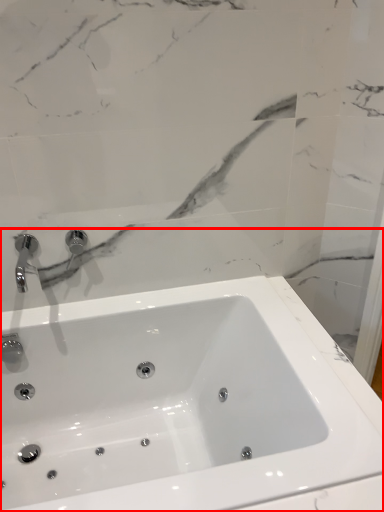
Question: From the image's perspective, what is the correct spatial relationship of sink (annotated by the red box) in relation to tap?

Choices:
 (A) above
 (B) below

Answer: (B)